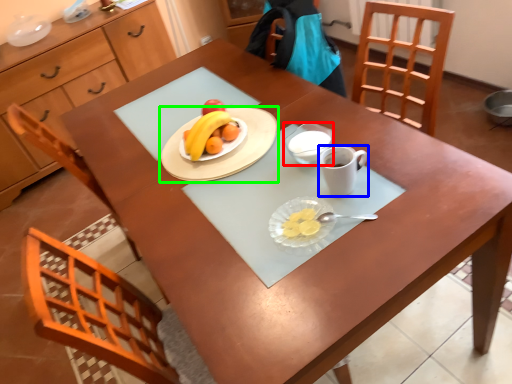
Question: Which object is the closest to the glass bowl (highlighted by a red box)? Choose among these: coffee cup (highlighted by a blue box) or tableware (highlighted by a green box).

Choices:
 (A) coffee cup
 (B) tableware

Answer: (A)